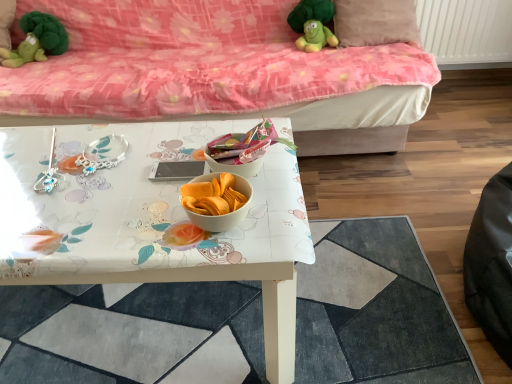
Question: Is green plush toy at upper left, which is the first toy in left-to-right order, not inside white glossy table at center?

Choices:
 (A) no
 (B) yes

Answer: (B)

Question: Does green plush toy at upper left, which is the first toy in left-to-right order, have a greater width compared to white glossy table at center?

Choices:
 (A) no
 (B) yes

Answer: (A)

Question: Is green plush toy at upper left, the 2th toy when ordered from right to left, turned away from white glossy table at center?

Choices:
 (A) no
 (B) yes

Answer: (A)

Question: Is the depth of green plush toy at upper left, which is the first toy in left-to-right order, greater than that of white glossy table at center?

Choices:
 (A) yes
 (B) no

Answer: (A)

Question: Considering the relative sizes of green plush toy at upper left, which is the first toy in left-to-right order, and white glossy table at center in the image provided, is green plush toy at upper left, which is the first toy in left-to-right order, thinner than white glossy table at center?

Choices:
 (A) no
 (B) yes

Answer: (B)

Question: Is white glossy table at center taller or shorter than green plush toy at upper left, the 2th toy when ordered from right to left?

Choices:
 (A) tall
 (B) short

Answer: (B)

Question: Is point (162, 324) closer or farther from the camera than point (31, 44)?

Choices:
 (A) closer
 (B) farther

Answer: (A)

Question: Is white glossy table at center inside the boundaries of green plush toy at upper left, the 2th toy when ordered from right to left, or outside?

Choices:
 (A) outside
 (B) inside

Answer: (A)

Question: In terms of size, does white glossy table at center appear bigger or smaller than green plush toy at upper left, which is the first toy in left-to-right order?

Choices:
 (A) big
 (B) small

Answer: (A)

Question: Looking at their shapes, would you say white glossy table at center is wider or thinner than velvet pink couch at upper center?

Choices:
 (A) thin
 (B) wide

Answer: (B)

Question: Is point (139, 324) positioned closer to the camera than point (339, 109)?

Choices:
 (A) farther
 (B) closer

Answer: (B)

Question: Would you say white glossy table at center is inside or outside velvet pink couch at upper center?

Choices:
 (A) inside
 (B) outside

Answer: (B)

Question: From the image's perspective, relative to velvet pink couch at upper center, is white glossy table at center above or below?

Choices:
 (A) below
 (B) above

Answer: (A)

Question: Is velvet pink couch at upper center inside or outside of green plush toy at upper left, which is the first toy in left-to-right order?

Choices:
 (A) inside
 (B) outside

Answer: (B)

Question: From a real-world perspective, is velvet pink couch at upper center physically located above or below green plush toy at upper left, the 2th toy when ordered from right to left?

Choices:
 (A) above
 (B) below

Answer: (B)